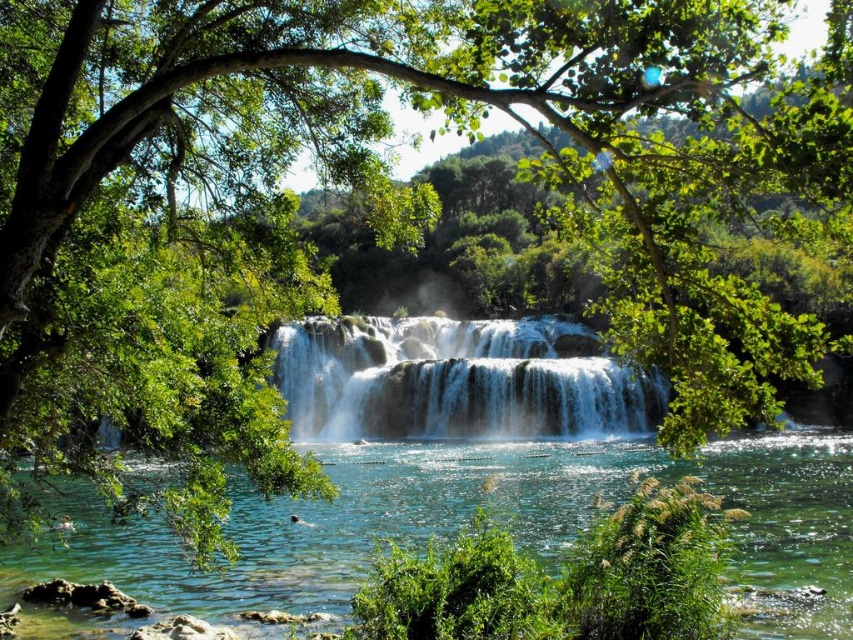
You are a photographer planning to capture the waterfall in this scene. You notice two distinct water areas in the image. One is the clear blue water at center and the other is the white frothy water at center. Which of these two water areas is lower in elevation?

The clear blue water at center has a lesser height compared to white frothy water at center, so the clear blue water at center is lower in elevation.

You are standing at the base of the waterfall and want to walk towards the two points marked in the image. Which point, point (413, 445) or point (396, 400), will you reach first?

Point (413, 445) is in front of point (396, 400), so you will reach point (413, 445) first.

You are a photographer standing at the edge of the waterfall. You notice the clear blue water at center and the white frothy water at center. Which one is located below the other?

The clear blue water at center is positioned under the white frothy water at center.